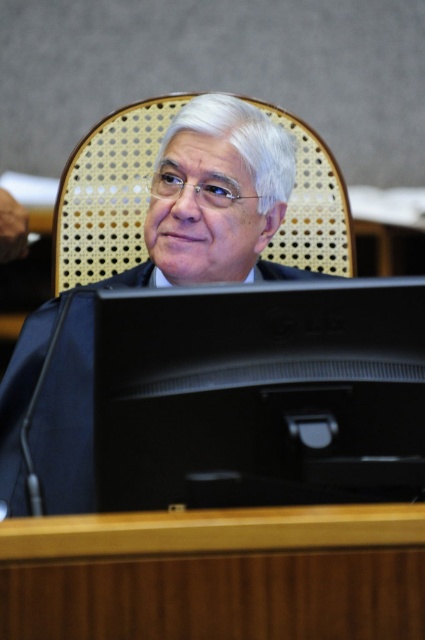
Who is higher up, black glossy monitor at center or brown woven chair at center?

Positioned higher is brown woven chair at center.

Who is lower down, black glossy monitor at center or brown woven chair at center?

Positioned lower is black glossy monitor at center.

Between point (376, 497) and point (93, 273), which one is positioned in front?

Positioned in front is point (376, 497).

Where is `black glossy monitor at center`? The height and width of the screenshot is (640, 425). black glossy monitor at center is located at coordinates (260, 394).

Can you confirm if wooden table at center is taller than brown woven chair at center?

No.

Based on the photo, is wooden table at center shorter than brown woven chair at center?

Yes.

Is point (365, 556) less distant than point (329, 202)?

Yes, it is in front of point (329, 202).

Where is `wooden table at center`? The image size is (425, 640). wooden table at center is located at coordinates (x=217, y=573).

Based on the photo, how much distance is there between black glossy monitor at center and wooden table at center?

They are 6.80 inches apart.

Can you confirm if black glossy monitor at center is smaller than wooden table at center?

No, black glossy monitor at center is not smaller than wooden table at center.

Is point (337, 356) positioned before point (50, 570)?

No, it is behind (50, 570).

At what (x,y) coordinates should I click in order to perform the action: click on black glossy monitor at center. Please return your answer as a coordinate pair (x, y). Looking at the image, I should click on (260, 394).